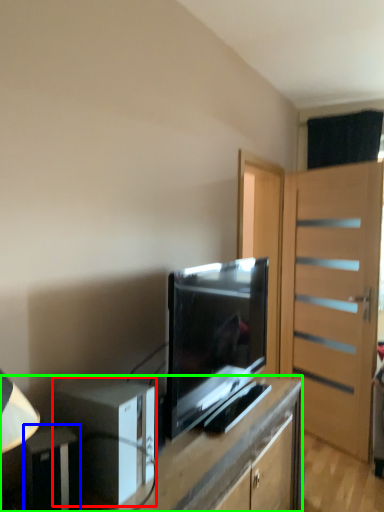
Question: Considering the real-world distances, which object is closest to appliance (highlighted by a red box)? appliance (highlighted by a blue box) or desk (highlighted by a green box).

Choices:
 (A) appliance
 (B) desk

Answer: (A)